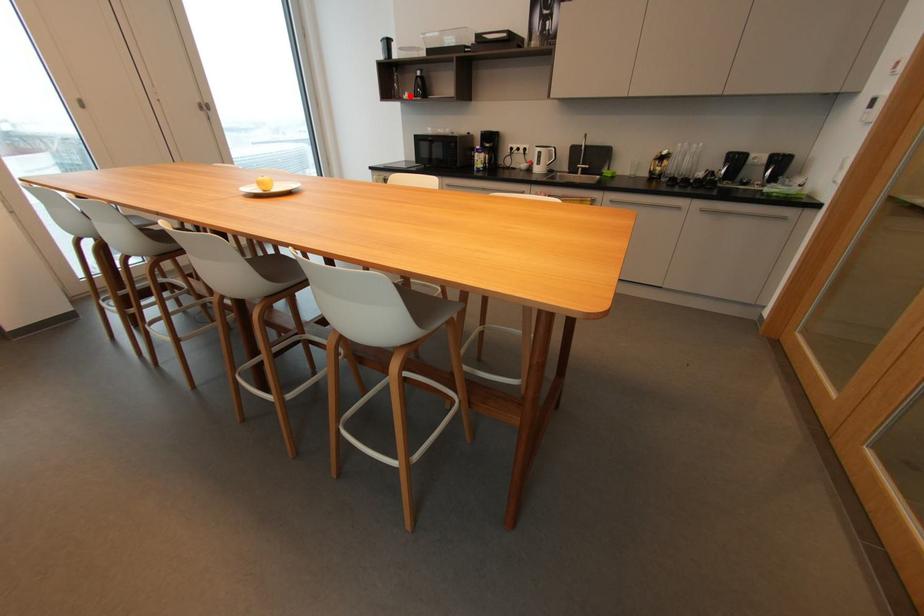
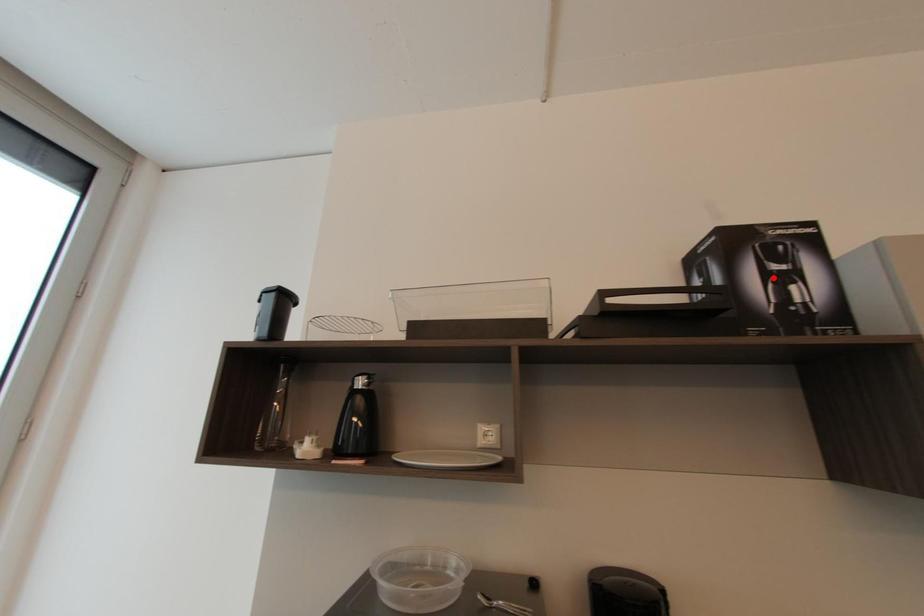
I am providing you with two images of the same scene from different viewpoints. A red point is marked on the first image and another point is marked on the second image. Does the point marked in image1 correspond to the same location as the one in image2?

No